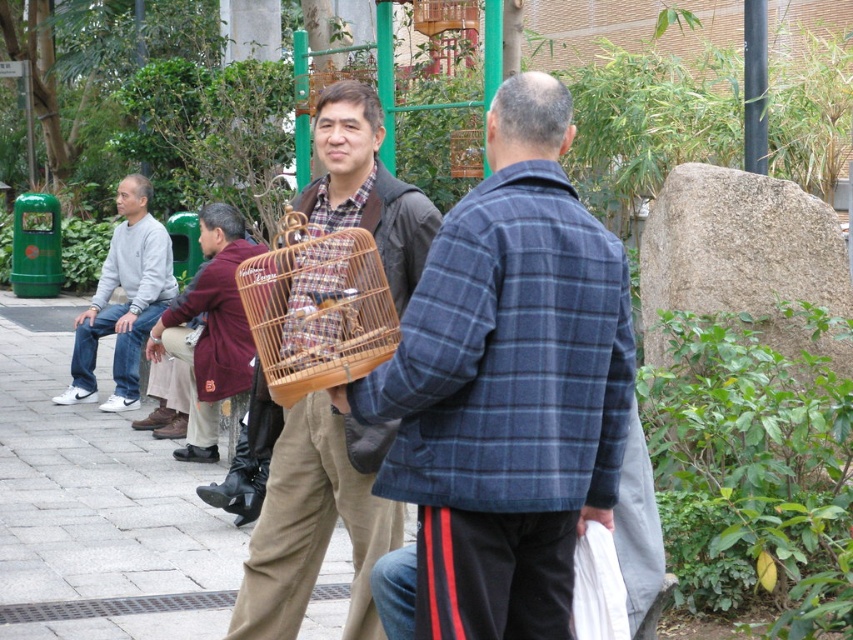
Find the location of a particular element. This screenshot has width=853, height=640. wooden birdcage at center is located at coordinates (312, 515).

Can you confirm if wooden birdcage at center is thinner than matte gray sweatshirt at left?

Indeed, wooden birdcage at center has a lesser width compared to matte gray sweatshirt at left.

Where is `wooden birdcage at center`? This screenshot has width=853, height=640. wooden birdcage at center is located at coordinates (312, 515).

Identify the location of wooden birdcage at center. This screenshot has width=853, height=640. (312, 515).

Who is positioned more to the right, maroon fabric jacket at center or matte gray sweatshirt at left?

Positioned to the right is maroon fabric jacket at center.

Does point (200, 397) lie behind point (111, 401)?

No, it is not.

Locate an element on the screen. This screenshot has width=853, height=640. maroon fabric jacket at center is located at coordinates (210, 332).

This screenshot has width=853, height=640. What do you see at coordinates (508, 385) in the screenshot?
I see `plaid woolen jacket at center` at bounding box center [508, 385].

Which is more to the left, plaid woolen jacket at center or bamboo wicker birdcage at center?

bamboo wicker birdcage at center is more to the left.

Who is more forward, [596,435] or [260,266]?

Point [596,435] is more forward.

Find the location of a particular element. The image size is (853, 640). plaid woolen jacket at center is located at coordinates (508, 385).